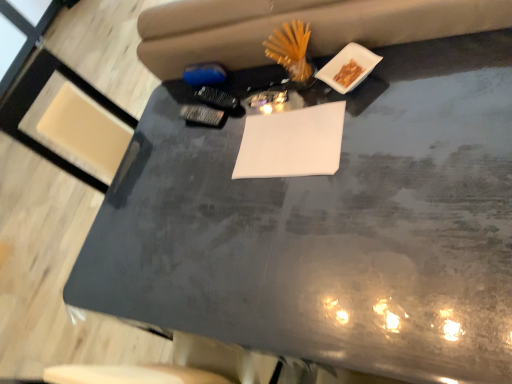
You are a GUI agent. You are given a task and a screenshot of the screen. Output one action in this format:
    pyautogui.click(x=<x>, y=<y>)
    Task: Click on the free location to the right of white paper at center
    This screenshot has height=384, width=512.
    Given the screenshot: What is the action you would take?
    pyautogui.click(x=379, y=99)